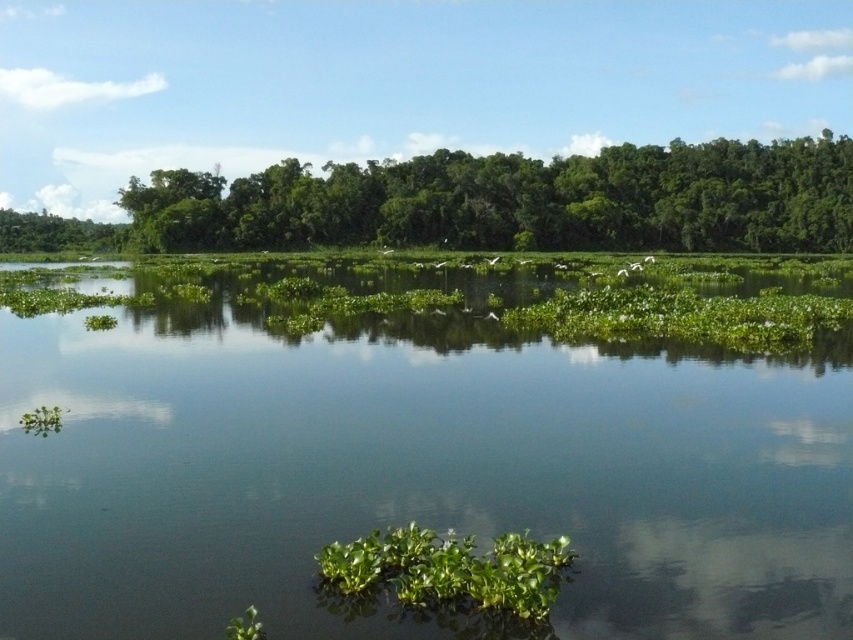
You are standing on the dock and see the green leafy vegetation at center and the green leafy trees at upper center. Which one is closer to you?

The green leafy vegetation at center is closer to you because it is positioned under the green leafy trees at upper center.

You are standing at the lakeside and see the green leafy trees at upper center and the green leafy tree at upper left. Which one appears taller in the scene?

The green leafy trees at upper center appears much taller than the green leafy tree at upper left.